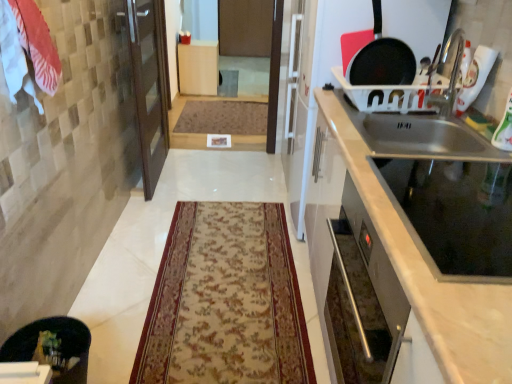
Question: Is beige floral rug at center, which is the 2th mat from back to front, far from white cotton towel at upper left?

Choices:
 (A) yes
 (B) no

Answer: (A)

Question: Is beige floral rug at center, which is the 2th mat in top-to-bottom order, placed right next to white cotton towel at upper left?

Choices:
 (A) no
 (B) yes

Answer: (A)

Question: Is beige floral rug at center, which is the 2th mat from back to front, positioned with its back to white cotton towel at upper left?

Choices:
 (A) yes
 (B) no

Answer: (B)

Question: Can you confirm if beige floral rug at center, which is the 2th mat from back to front, is wider than white cotton towel at upper left?

Choices:
 (A) yes
 (B) no

Answer: (A)

Question: Does beige floral rug at center, which is the 2th mat from back to front, have a larger size compared to white cotton towel at upper left?

Choices:
 (A) yes
 (B) no

Answer: (A)

Question: From a real-world perspective, is beige floral rug at center, marked as the 1th mat in a front-to-back arrangement, over white cotton towel at upper left?

Choices:
 (A) yes
 (B) no

Answer: (B)

Question: Is satin silver oven at right, which is the first cabinetry from right to left, wider than beige floral rug at center, marked as the 1th mat in a front-to-back arrangement?

Choices:
 (A) yes
 (B) no

Answer: (B)

Question: Is beige floral rug at center, marked as the 1th mat in a front-to-back arrangement, surrounded by satin silver oven at right, which is counted as the second cabinetry, starting from the left?

Choices:
 (A) yes
 (B) no

Answer: (B)

Question: Considering the relative sizes of satin silver oven at right, marked as the 2th cabinetry in a top-to-bottom arrangement, and beige floral rug at center, arranged as the 1th mat when ordered from the bottom, in the image provided, is satin silver oven at right, marked as the 2th cabinetry in a top-to-bottom arrangement, bigger than beige floral rug at center, arranged as the 1th mat when ordered from the bottom,?

Choices:
 (A) yes
 (B) no

Answer: (A)

Question: Is satin silver oven at right, which is the 1th cabinetry in front-to-back order, positioned in front of beige floral rug at center, marked as the 1th mat in a front-to-back arrangement?

Choices:
 (A) no
 (B) yes

Answer: (B)

Question: Is satin silver oven at right, the 1th cabinetry when ordered from bottom to top, far away from beige floral rug at center, marked as the 1th mat in a front-to-back arrangement?

Choices:
 (A) yes
 (B) no

Answer: (B)

Question: Is the position of satin silver oven at right, which ranks as the second cabinetry in back-to-front order, more distant than that of beige floral rug at center, which is the 2th mat in top-to-bottom order?

Choices:
 (A) no
 (B) yes

Answer: (A)

Question: Can you confirm if black matte frying pan at upper right is positioned to the left of beige floral rug at center, which is the 2th mat from back to front?

Choices:
 (A) no
 (B) yes

Answer: (A)